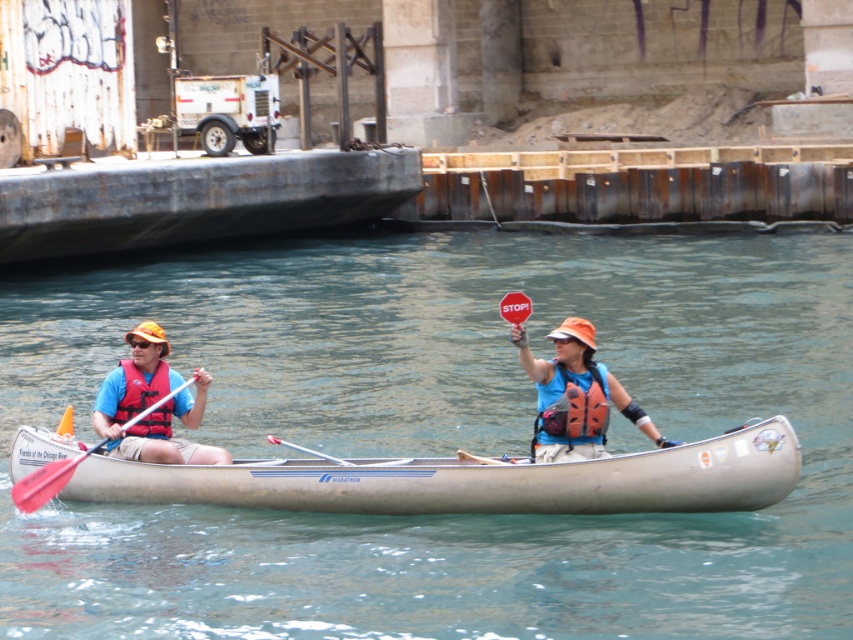
Is point (218, 454) in front of point (570, 384)?

No, it is behind (570, 384).

Who is more forward, (212,449) or (541,408)?

Point (541,408) is in front.

This screenshot has height=640, width=853. I want to click on blue life vest at left, so click(151, 403).

Who is more forward, (440, 346) or (592, 397)?

Positioned in front is point (592, 397).

Describe the element at coordinates (439, 436) in the screenshot. The width and height of the screenshot is (853, 640). I see `clear blue water at center` at that location.

Identify the location of clear blue water at center. (439, 436).

Is point (577, 352) behind point (131, 337)?

No.

Which is above, orange life vest at center or blue life vest at left?

blue life vest at left

Which is behind, point (590, 339) or point (125, 451)?

The point (125, 451) is behind.

I want to click on orange life vest at center, so click(x=575, y=396).